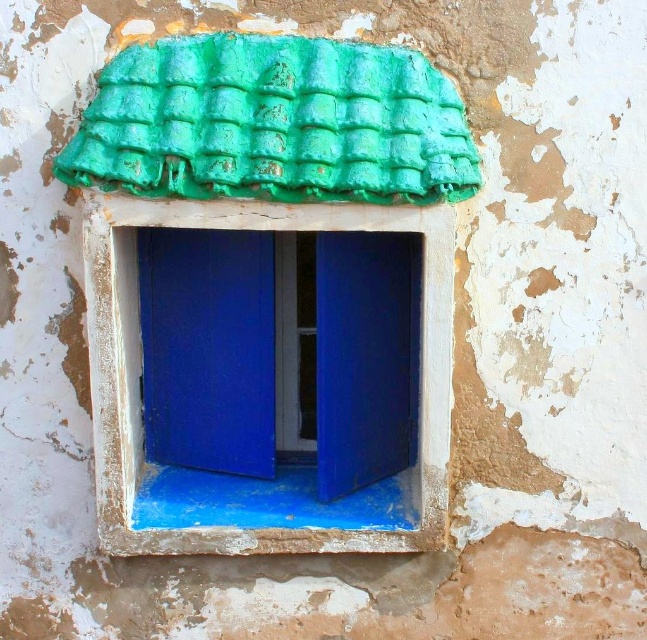
Question: Among these objects, which one is farthest from the camera?

Choices:
 (A) white painted wood at center
 (B) green textured tiles at upper center

Answer: (A)

Question: Is green textured tiles at upper center thinner than white painted wood at center?

Choices:
 (A) no
 (B) yes

Answer: (A)

Question: Among these objects, which one is farthest from the camera?

Choices:
 (A) white painted wood at center
 (B) green textured tiles at upper center

Answer: (A)

Question: Does green textured tiles at upper center appear on the right side of white painted wood at center?

Choices:
 (A) no
 (B) yes

Answer: (A)

Question: Where is green textured tiles at upper center located in relation to white painted wood at center in the image?

Choices:
 (A) left
 (B) right

Answer: (A)

Question: Which object appears farthest from the camera in this image?

Choices:
 (A) green textured tiles at upper center
 (B) white painted wood at center

Answer: (B)